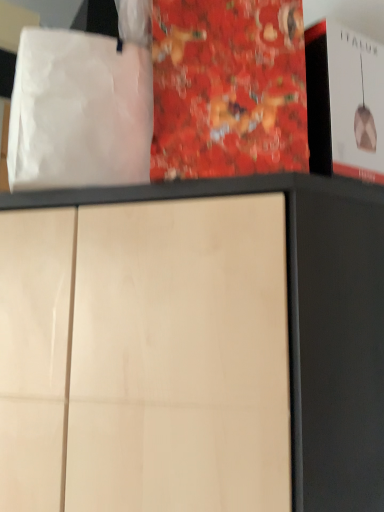
What do you see at coordinates (79, 112) in the screenshot?
I see `white paper bag at upper left` at bounding box center [79, 112].

Where is `white paper bag at upper left`? The height and width of the screenshot is (512, 384). white paper bag at upper left is located at coordinates (79, 112).

Measure the distance between point (60, 57) and camera.

Point (60, 57) is 28.43 inches from camera.

At what (x,y) coordinates should I click in order to perform the action: click on red glossy book at center. Please return your answer as a coordinate pair (x, y). Image resolution: width=384 pixels, height=512 pixels. Looking at the image, I should click on (228, 88).

What do you see at coordinates (228, 88) in the screenshot? I see `red glossy book at center` at bounding box center [228, 88].

The width and height of the screenshot is (384, 512). Find the location of `white paper bag at upper left`. white paper bag at upper left is located at coordinates (79, 112).

Considering the positions of objects red glossy book at center and white paper bag at upper left in the image provided, who is more to the right, red glossy book at center or white paper bag at upper left?

red glossy book at center.

Does red glossy book at center lie in front of white paper bag at upper left?

No, it is not.

Is point (200, 166) positioned before point (32, 40)?

Yes, it is.

From the image's perspective, is red glossy book at center positioned above or below white paper bag at upper left?

Clearly, from the image's perspective, red glossy book at center is above white paper bag at upper left.

Consider the image. From a real-world perspective, is red glossy book at center below white paper bag at upper left?

Incorrect, from a real-world perspective, red glossy book at center is higher than white paper bag at upper left.

Between red glossy book at center and white paper bag at upper left, which one has smaller width?

Thinner between the two is red glossy book at center.

Which of these two, red glossy book at center or white paper bag at upper left, stands shorter?

With less height is white paper bag at upper left.

Can you confirm if red glossy book at center is bigger than white paper bag at upper left?

Yes, red glossy book at center is bigger than white paper bag at upper left.

Is red glossy book at center inside or outside of white paper bag at upper left?

red glossy book at center lies outside white paper bag at upper left.

Is red glossy book at center beside white paper bag at upper left?

No, red glossy book at center is not making contact with white paper bag at upper left.

Could you tell me if red glossy book at center is facing white paper bag at upper left?

No, red glossy book at center is not facing towards white paper bag at upper left.

How many degrees apart are the facing directions of red glossy book at center and white paper bag at upper left?

24.1 degrees separate the facing orientations of red glossy book at center and white paper bag at upper left.

Find the location of `paperback book on the right of white paper bag at upper left`. paperback book on the right of white paper bag at upper left is located at coordinates (228, 88).

Considering the relative positions of white paper bag at upper left and red glossy book at center in the image provided, is white paper bag at upper left to the left of red glossy book at center from the viewer's perspective?

Yes.

Which object is closer to the camera, white paper bag at upper left or red glossy book at center?

white paper bag at upper left is more forward.

Considering the positions of point (113, 121) and point (227, 174), is point (113, 121) closer or farther from the camera than point (227, 174)?

Point (113, 121).

Consider the image. From the image's perspective, which is above, white paper bag at upper left or red glossy book at center?

red glossy book at center, from the image's perspective.

Looking at this image, from a real-world perspective, is white paper bag at upper left positioned above or below red glossy book at center?

white paper bag at upper left is situated lower than red glossy book at center in the real world.

From the picture: Is white paper bag at upper left thinner than red glossy book at center?

In fact, white paper bag at upper left might be wider than red glossy book at center.

From their relative heights in the image, would you say white paper bag at upper left is taller or shorter than red glossy book at center?

Considering their sizes, white paper bag at upper left has less height than red glossy book at center.

Based on the photo, who is bigger, white paper bag at upper left or red glossy book at center?

red glossy book at center.

Would you say red glossy book at center is part of white paper bag at upper left's contents?

No.

Is white paper bag at upper left positioned far away from red glossy book at center?

That's not correct — white paper bag at upper left is a little close to red glossy book at center.

Is red glossy book at center at the back of white paper bag at upper left?

No.

Can you tell me how much white paper bag at upper left and red glossy book at center differ in facing direction?

There is a 24.1-degree angle between the facing directions of white paper bag at upper left and red glossy book at center.

How much distance is there between white paper bag at upper left and red glossy book at center?

white paper bag at upper left and red glossy book at center are 5.64 inches apart from each other.

Identify the location of tote bag below the red glossy book at center (from the image's perspective). (79, 112).

Image resolution: width=384 pixels, height=512 pixels. I want to click on paperback book above the white paper bag at upper left (from a real-world perspective), so click(x=228, y=88).

I want to click on paperback book behind the white paper bag at upper left, so click(228, 88).